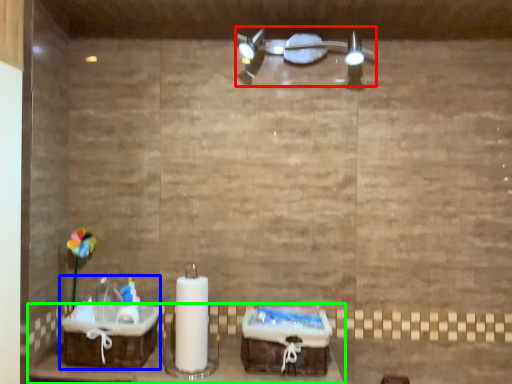
Question: Considering the real-world distances, which object is farthest from light fixture (highlighted by a red box)? sink (highlighted by a blue box) or furniture (highlighted by a green box)?

Choices:
 (A) sink
 (B) furniture

Answer: (A)